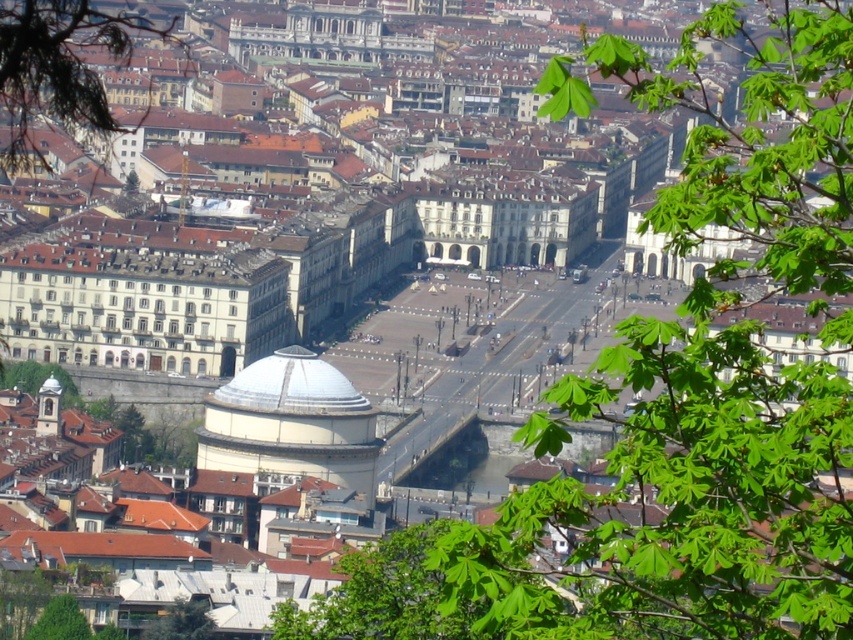
Question: Is white matte dome at center above green leafy tree at lower left?

Choices:
 (A) yes
 (B) no

Answer: (A)

Question: Which object is the closest to the green leafy tree at upper right?

Choices:
 (A) white matte dome at center
 (B) green leafy tree at upper left
 (C) green leafy tree at lower left

Answer: (A)

Question: Does white matte dome at center have a lesser width compared to green leafy tree at lower left?

Choices:
 (A) no
 (B) yes

Answer: (A)

Question: Is green leafy tree at upper right to the right of green leafy tree at upper left from the viewer's perspective?

Choices:
 (A) no
 (B) yes

Answer: (B)

Question: Which point is farther from the camera taking this photo?

Choices:
 (A) (15, 74)
 (B) (177, 637)
 (C) (700, 483)

Answer: (B)

Question: Which object appears farthest from the camera in this image?

Choices:
 (A) white matte dome at center
 (B) green leafy tree at upper left

Answer: (A)